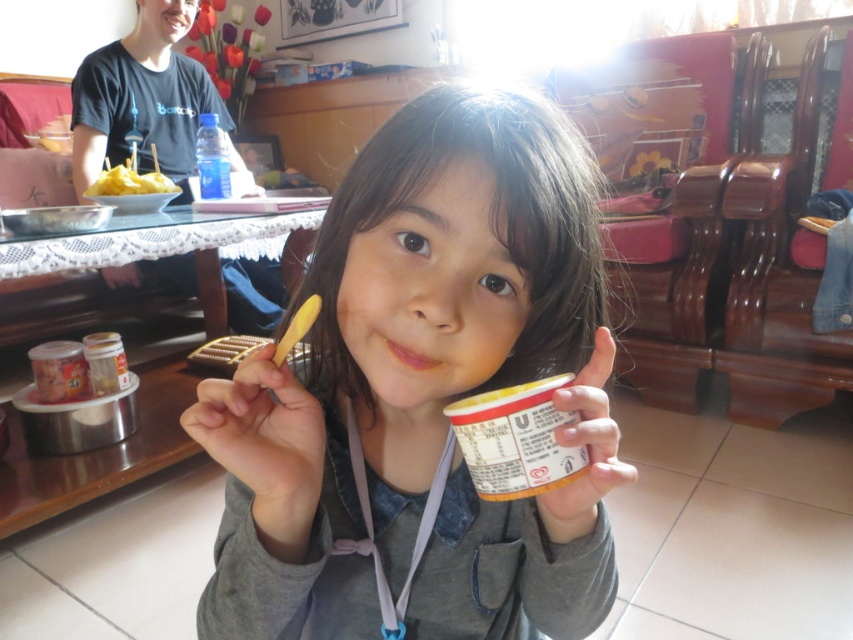
Which of these two, matte gray sweater at center or yellow matte food at left, stands taller?

matte gray sweater at center is taller.

Does matte gray sweater at center appear under yellow matte food at left?

Indeed, matte gray sweater at center is positioned under yellow matte food at left.

Where is `matte gray sweater at center`? This screenshot has width=853, height=640. matte gray sweater at center is located at coordinates (422, 394).

At what (x,y) coordinates should I click in order to perform the action: click on matte gray sweater at center. Please return your answer as a coordinate pair (x, y). Looking at the image, I should click on (422, 394).